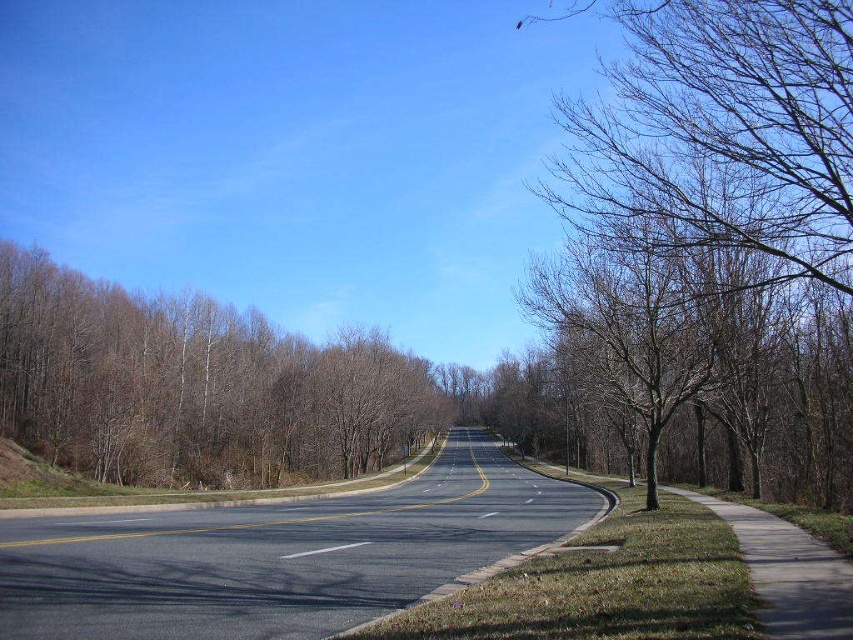
Which is more to the left, bare branches at right or brown/dry wood trees at left?

Positioned to the left is brown/dry wood trees at left.

Does bare branches at right have a lesser height compared to brown/dry wood trees at left?

No.

What do you see at coordinates (718, 144) in the screenshot? I see `bare branches at right` at bounding box center [718, 144].

You are a GUI agent. You are given a task and a screenshot of the screen. Output one action in this format:
    pyautogui.click(x=<x>, y=<y>)
    Task: Click on the bare branches at right
    Image resolution: width=853 pixels, height=640 pixels.
    Given the screenshot: What is the action you would take?
    pyautogui.click(x=718, y=144)